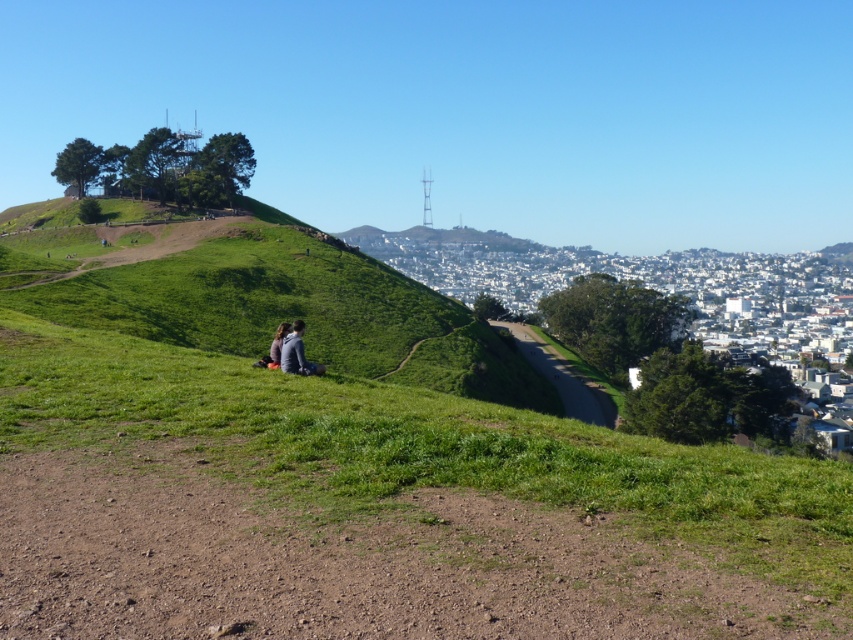
Is green grassy hillside at center positioned before dark gray jacket at center?

No.

Between green grassy hillside at center and dark gray jacket at center, which one has more height?

Standing taller between the two is green grassy hillside at center.

Is point (326, 348) behind point (283, 362)?

That is True.

At what (x,y) coordinates should I click in order to perform the action: click on green grassy hillside at center. Please return your answer as a coordinate pair (x, y). This screenshot has width=853, height=640. Looking at the image, I should click on (297, 310).